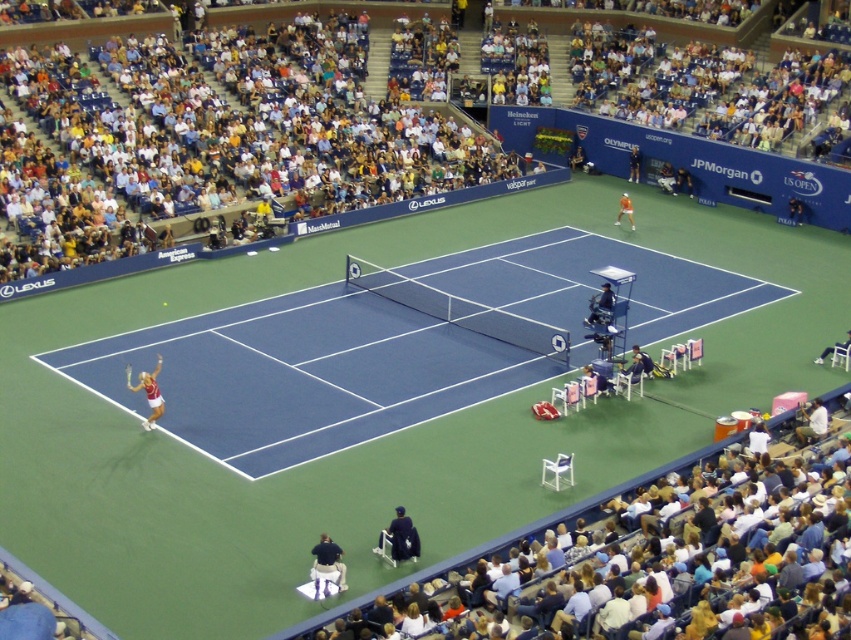
Can you confirm if white plastic chair at lower right is positioned to the left of dark blue fabric chair at upper right?

Correct, you'll find white plastic chair at lower right to the left of dark blue fabric chair at upper right.

From the picture: Does white plastic chair at lower right appear on the right side of dark blue fabric chair at upper right?

Incorrect, white plastic chair at lower right is not on the right side of dark blue fabric chair at upper right.

Is point (461, 609) closer to viewer compared to point (597, 312)?

That is True.

Where is `white plastic chair at lower right`? The image size is (851, 640). white plastic chair at lower right is located at coordinates (641, 566).

Is point (390, 525) farther from camera compared to point (598, 308)?

No, it is not.

Which is below, dark blue fabric chair at center or dark blue fabric chair at upper right?

Positioned lower is dark blue fabric chair at center.

Image resolution: width=851 pixels, height=640 pixels. What do you see at coordinates (403, 536) in the screenshot? I see `dark blue fabric chair at center` at bounding box center [403, 536].

What are the coordinates of `dark blue fabric chair at center` in the screenshot? It's located at (403, 536).

Who is shorter, white tennis racket at upper right or white matte tennis racket at left?

Standing shorter between the two is white matte tennis racket at left.

Does point (631, 157) come in front of point (124, 369)?

No, it is behind (124, 369).

At what (x,y) coordinates should I click in order to perform the action: click on white tennis racket at upper right. Please return your answer as a coordinate pair (x, y). Looking at the image, I should click on (632, 163).